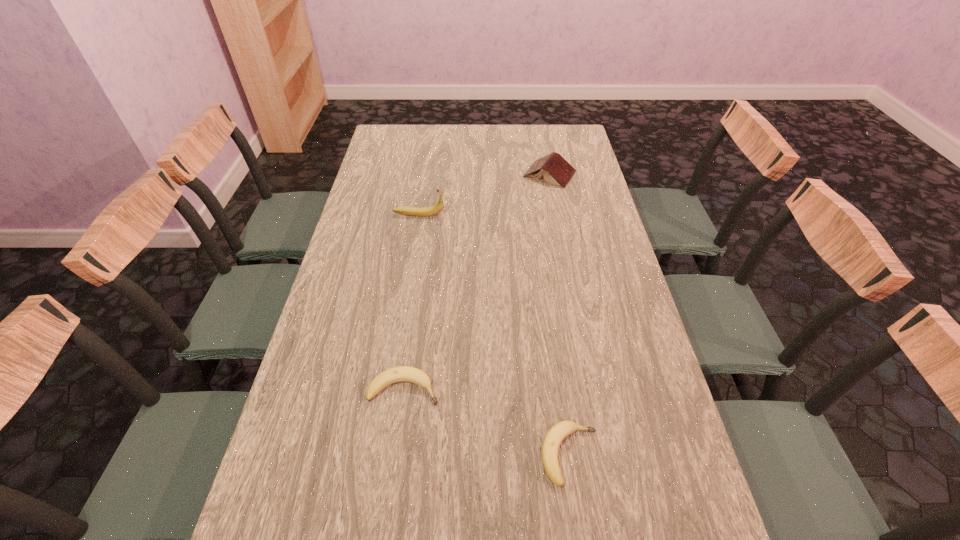
The width and height of the screenshot is (960, 540). I want to click on the tallest object, so click(438, 207).

Find the location of `the tallest banana`. the tallest banana is located at coordinates (438, 207).

You are a GUI agent. You are given a task and a screenshot of the screen. Output one action in this format:
    pyautogui.click(x=<x>, y=<y>)
    Task: Click on the book
    Image resolution: width=960 pixels, height=540 pixels.
    Given the screenshot: What is the action you would take?
    pyautogui.click(x=555, y=169)

Locate an element on the screen. The height and width of the screenshot is (540, 960). the second tallest object is located at coordinates (555, 169).

Where is `the second nearest object`? the second nearest object is located at coordinates (401, 373).

Where is `the nearest object`? This screenshot has height=540, width=960. the nearest object is located at coordinates (555, 436).

Find the location of a particular element. The image size is (960, 540). the nearest banana is located at coordinates (555, 436).

Image resolution: width=960 pixels, height=540 pixels. In order to click on vacant space situated 0.340m at the stem of the tallest banana in this screenshot , I will do `click(543, 214)`.

Locate an element on the screen. free space located 0.110m on the front of the book is located at coordinates (556, 207).

At what (x,y) coordinates should I click in order to perform the action: click on vacant space situated at the stem of the third farthest object. Please return your answer as a coordinate pair (x, y). The height and width of the screenshot is (540, 960). Looking at the image, I should click on (531, 389).